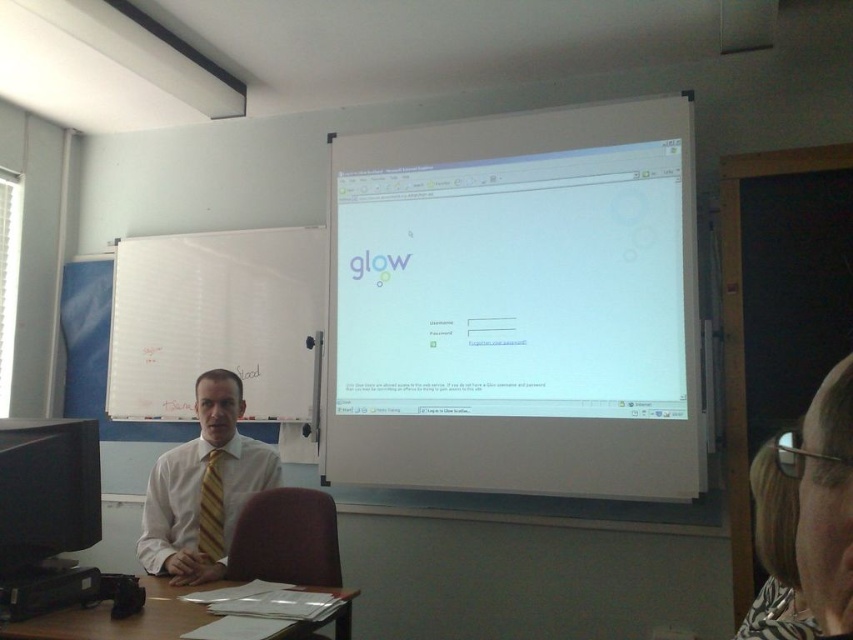
Can you confirm if brown wooden table at lower left is taller than yellow striped tie at center?

Incorrect, brown wooden table at lower left's height is not larger of yellow striped tie at center's.

You are a GUI agent. You are given a task and a screenshot of the screen. Output one action in this format:
    pyautogui.click(x=<x>, y=<y>)
    Task: Click on the brown wooden table at lower left
    
    Given the screenshot: What is the action you would take?
    pyautogui.click(x=120, y=620)

Does point (195, 611) come farther from viewer compared to point (213, 513)?

No, it is not.

Find the location of a particular element. The height and width of the screenshot is (640, 853). brown wooden table at lower left is located at coordinates (120, 620).

Is white glossy projection screen at upper center closer to the viewer compared to white shirt at center?

That is False.

Can you confirm if white glossy projection screen at upper center is taller than white shirt at center?

Correct, white glossy projection screen at upper center is much taller as white shirt at center.

Is point (358, 228) less distant than point (225, 520)?

No, it is behind (225, 520).

Image resolution: width=853 pixels, height=640 pixels. I want to click on white glossy projection screen at upper center, so click(515, 305).

Which is in front, point (169, 465) or point (201, 536)?

Point (201, 536) is more forward.

Does point (248, 497) come closer to viewer compared to point (210, 497)?

Yes, it is.

Image resolution: width=853 pixels, height=640 pixels. Describe the element at coordinates (202, 486) in the screenshot. I see `white shirt at center` at that location.

Locate an element on the screen. white shirt at center is located at coordinates (202, 486).